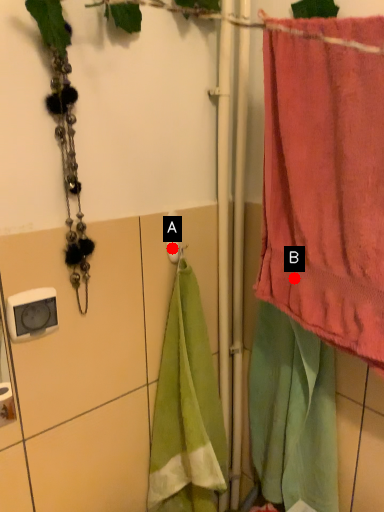
Question: Two points are circled on the image, labeled by A and B beside each circle. Which point is closer to the camera?

Choices:
 (A) A is closer
 (B) B is closer

Answer: (B)